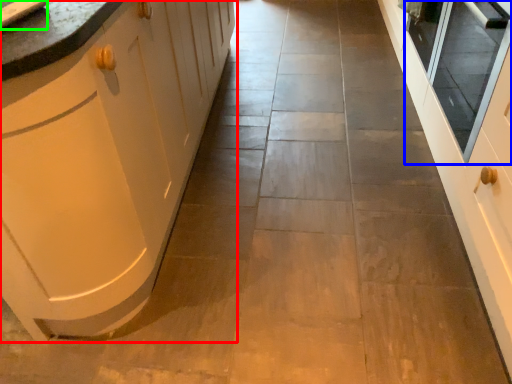
Question: Which is nearer to the cabinetry (highlighted by a red box)? window screen (highlighted by a blue box) or sink (highlighted by a green box).

Choices:
 (A) window screen
 (B) sink

Answer: (B)